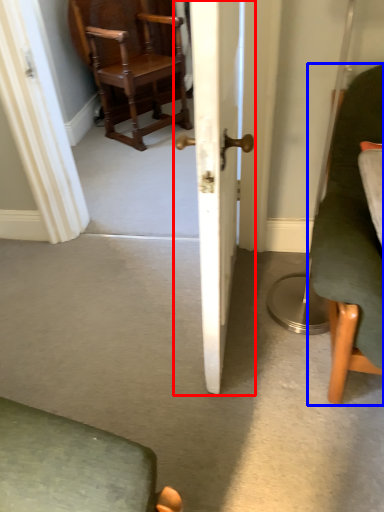
Question: Which of the following is the farthest to the observer, door (highlighted by a red box) or chair (highlighted by a blue box)?

Choices:
 (A) door
 (B) chair

Answer: (B)